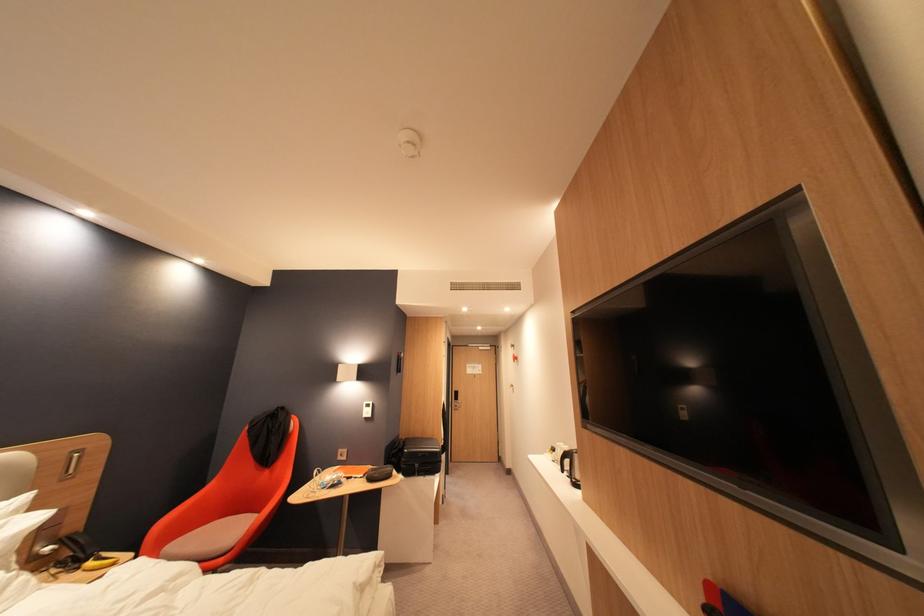
What do you see at coordinates (563, 458) in the screenshot? I see `the black kettle handle` at bounding box center [563, 458].